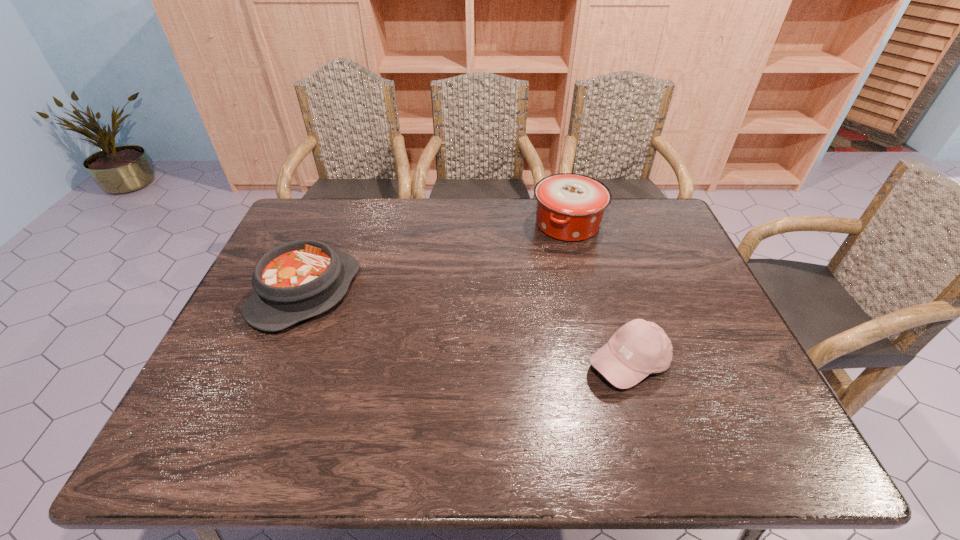
I want to click on the tallest object, so click(x=570, y=207).

You are a GUI agent. You are given a task and a screenshot of the screen. Output one action in this format:
    pyautogui.click(x=<x>, y=<y>)
    Task: Click on the taller casserole
    This screenshot has width=960, height=540.
    Given the screenshot: What is the action you would take?
    pyautogui.click(x=570, y=207)

The image size is (960, 540). Find the location of `the leftmost object`. the leftmost object is located at coordinates (297, 280).

Where is `the nearer casserole`? the nearer casserole is located at coordinates (297, 280).

The height and width of the screenshot is (540, 960). Find the location of `baseball cap`. baseball cap is located at coordinates (639, 348).

The width and height of the screenshot is (960, 540). What are the coordinates of `vacant space located on the left of the right casserole` in the screenshot? It's located at tap(463, 224).

Where is `vacant space located on the front of the shorter casserole`? Image resolution: width=960 pixels, height=540 pixels. vacant space located on the front of the shorter casserole is located at coordinates (245, 444).

You are a GUI agent. You are given a task and a screenshot of the screen. Output one action in this format:
    pyautogui.click(x=<x>, y=<y>)
    Task: Click on the free space located on the front-facing side of the baseball cap
    
    Given the screenshot: What is the action you would take?
    pyautogui.click(x=655, y=451)

Where is `object that is at the far edge`? This screenshot has height=540, width=960. object that is at the far edge is located at coordinates (570, 207).

The height and width of the screenshot is (540, 960). Identify the location of object at the left edge. (297, 280).